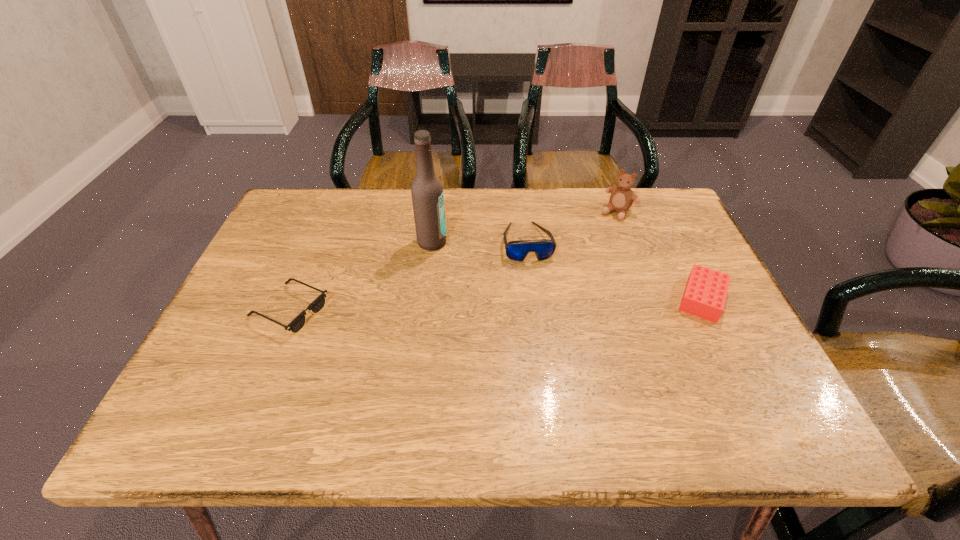
Find the location of `free space located on the lenses of the left sunglasses`. free space located on the lenses of the left sunglasses is located at coordinates (496, 310).

Find the location of a particular element. vacant area situated 0.300m on the back of the Lego is located at coordinates (657, 207).

I want to click on vacant space located 0.110m on the side of the beer bottle with the label, so click(x=475, y=265).

The height and width of the screenshot is (540, 960). I want to click on free space located 0.080m on the side of the beer bottle with the label, so click(x=467, y=260).

Where is `free space located on the side of the beer bottle with the label`? This screenshot has width=960, height=540. free space located on the side of the beer bottle with the label is located at coordinates (561, 309).

The image size is (960, 540). I want to click on free space located 0.240m on the front-facing side of the fourth object from left to right, so click(x=572, y=266).

Locate an element on the screen. This screenshot has height=540, width=960. free space located 0.160m on the front-facing side of the fourth object from left to right is located at coordinates (586, 249).

I want to click on free space located on the front-facing side of the fourth object from left to right, so click(x=566, y=272).

Find the location of a particular element. The height and width of the screenshot is (540, 960). free space located 0.300m on the front-facing side of the third object from right to left is located at coordinates (554, 361).

What are the coordinates of `vacant space positioned on the front-facing side of the third object from right to left` in the screenshot? It's located at (541, 308).